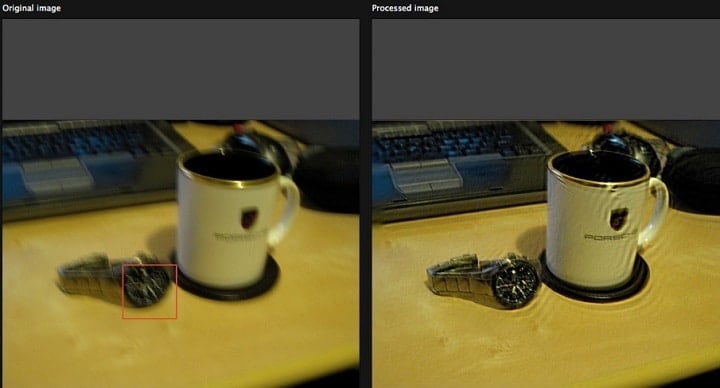
This screenshot has height=388, width=720. What are the coordinates of `beige table surface` in the screenshot? It's located at (443, 354), (414, 289), (672, 336), (698, 277), (42, 344), (29, 289), (314, 282), (212, 364).